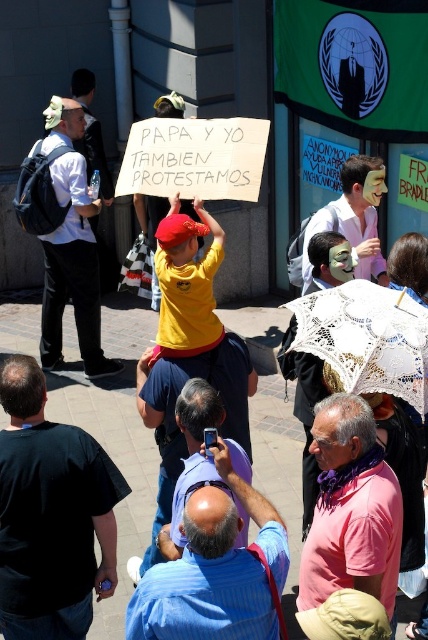
Question: Is blue striped shirt at center positioned behind pink matte shirt at center?

Choices:
 (A) no
 (B) yes

Answer: (A)

Question: Observing the image, what is the correct spatial positioning of pink matte shirt at center in reference to white shirt at center?

Choices:
 (A) right
 (B) left

Answer: (A)

Question: Which of these objects is positioned farthest from the blue striped shirt at center?

Choices:
 (A) white shirt at center
 (B) black shirt at lower left
 (C) white shirt with backpack at left
 (D) white matte mask at center

Answer: (A)

Question: Does white shirt with backpack at left have a lesser width compared to blue shirt at center?

Choices:
 (A) yes
 (B) no

Answer: (A)

Question: Which point appears closest to the camera in this image?

Choices:
 (A) (305, 387)
 (B) (100, 273)
 (C) (424, 376)

Answer: (C)

Question: Among these objects, which one is nearest to the camera?

Choices:
 (A) blue shirt at center
 (B) white shirt with backpack at left

Answer: (A)